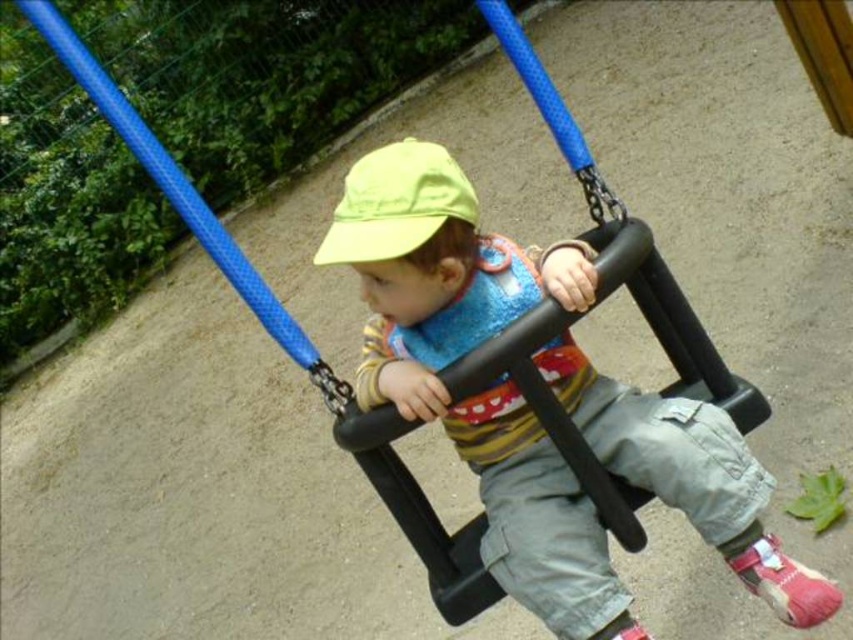
You are a photographer trying to capture the child in the swing. The matte black swing seat at center and the yellow fabric hat at center are both in your viewfinder. According to the scene, which object is positioned to the right of the other?

The matte black swing seat at center is to the right of the yellow fabric hat at center.

You are standing at the playground and want to reach the point marked as point (660, 497). If you can walk 5 feet in one minute, how long will it take you to reach that point?

The distance between you and point (660, 497) is 4.79 feet. Since you can walk 5 feet in a minute, it will take less than a minute to reach the point.

Based on the photo, you are a parent trying to ensure your child is safely seated on the swing. The swing has a matte black swing seat at center and your child is wearing a yellow fabric hat at center. Based on their sizes, can the swing seat accommodate the child comfortably?

The matte black swing seat at center might be wider than yellow fabric hat at center, so it should be able to accommodate the child comfortably.